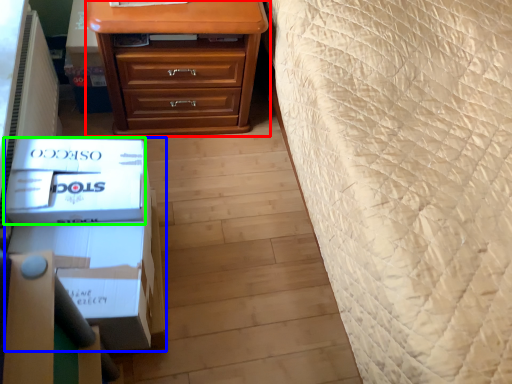
Question: Estimate the real-world distances between objects in this image. Which object is closer to chest of drawers (highlighted by a red box), box (highlighted by a blue box) or box (highlighted by a green box)?

Choices:
 (A) box
 (B) box

Answer: (B)